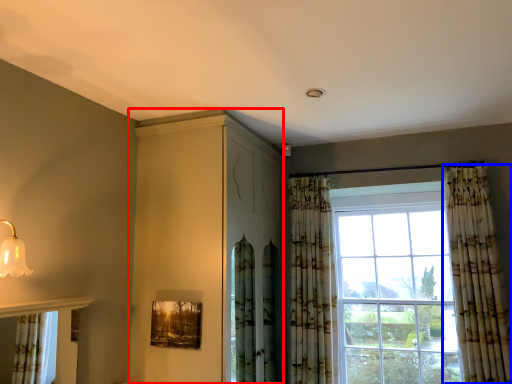
Question: Which object is further to the camera taking this photo, dresser (highlighted by a red box) or curtain (highlighted by a blue box)?

Choices:
 (A) dresser
 (B) curtain

Answer: (B)